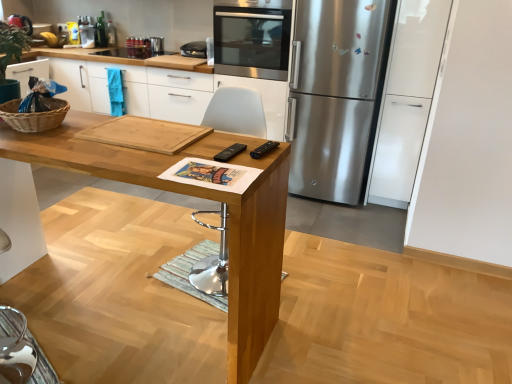
Where is `free region under natural wood table at center (from a real-world perspective)`? The height and width of the screenshot is (384, 512). free region under natural wood table at center (from a real-world perspective) is located at coordinates (133, 316).